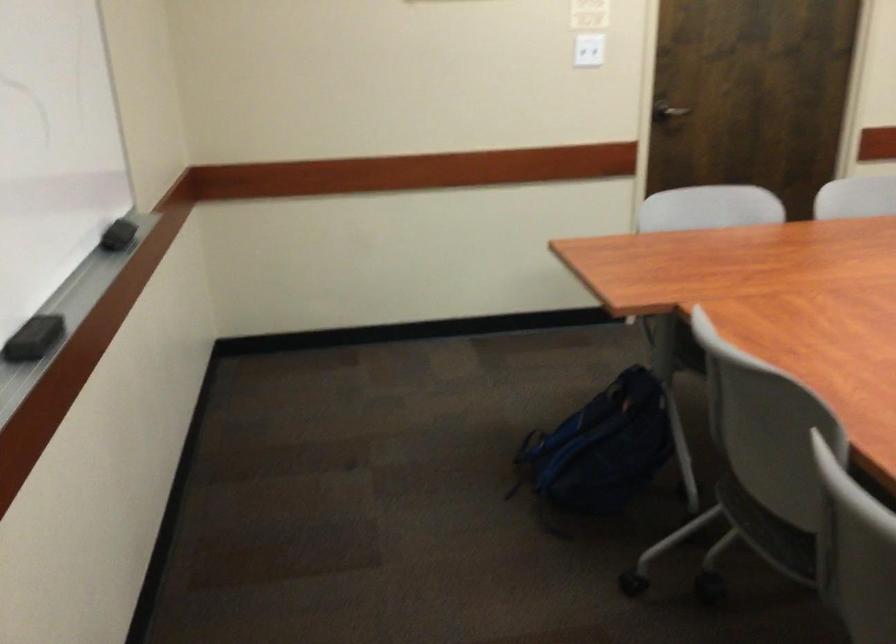
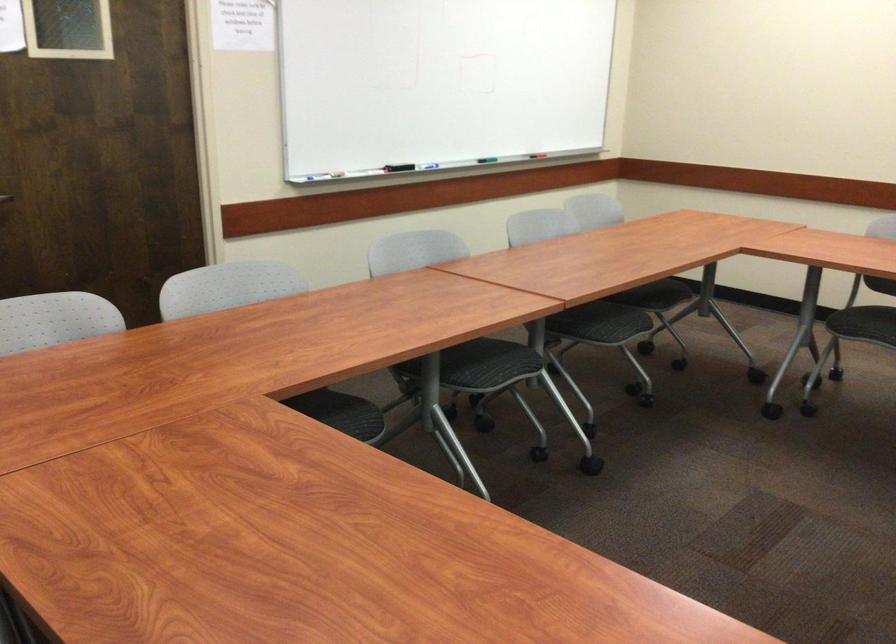
The point at (694,107) is marked in the first image. Where is the corresponding point in the second image?

(5, 198)